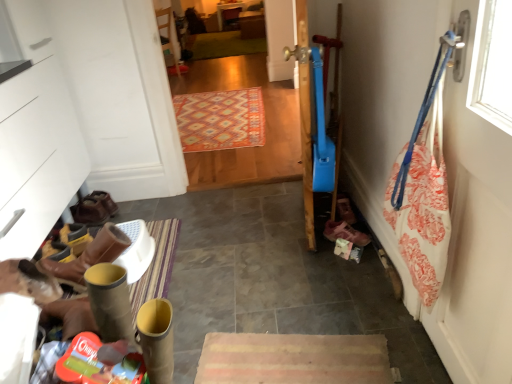
The image size is (512, 384). What do you see at coordinates (105, 201) in the screenshot? I see `brown leather boots at lower left, positioned as the second footwear in right-to-left order` at bounding box center [105, 201].

You are a GUI agent. You are given a task and a screenshot of the screen. Output one action in this format:
    pyautogui.click(x=<x>, y=<y>)
    Task: Click on the green carpet at center, the first mat from the back
    The height and width of the screenshot is (384, 512).
    Given the screenshot: What is the action you would take?
    pyautogui.click(x=225, y=45)

This screenshot has width=512, height=384. Describe the element at coordinates (345, 233) in the screenshot. I see `pink fabric shoe at lower right, the 3th footwear positioned from the back` at that location.

The height and width of the screenshot is (384, 512). What do you see at coordinates (265, 125) in the screenshot?
I see `carpeted wooden floor at center` at bounding box center [265, 125].

What is the approximate height of carpeted wooden floor at center?

The height of carpeted wooden floor at center is 3.68 feet.

What do you see at coordinates (475, 235) in the screenshot? I see `white fabric at right` at bounding box center [475, 235].

The height and width of the screenshot is (384, 512). Identify the location of multicolored woven rug at center, the 1th mat viewed from the front. (220, 120).

Can you tell me how much brown leather boots at lower left, marked as the first footwear in a back-to-front arrangement, and pink fabric shoe at lower right, placed as the first footwear when sorted from right to left, differ in facing direction?

The facing directions of brown leather boots at lower left, marked as the first footwear in a back-to-front arrangement, and pink fabric shoe at lower right, placed as the first footwear when sorted from right to left, are 156 degrees apart.

Locate an element on the screen. The width and height of the screenshot is (512, 384). footwear that is the 2nd object located above the pink fabric shoe at lower right, placed as the first footwear when sorted from right to left (from the image's perspective) is located at coordinates (105, 201).

Is pink fabric shoe at lower right, the third footwear in the left-to-right sequence, a part of brown leather boots at lower left, the 2th footwear positioned from the left?

No, brown leather boots at lower left, the 2th footwear positioned from the left, does not contain pink fabric shoe at lower right, the third footwear in the left-to-right sequence.

Between brown leather boots at lower left, marked as the 3th footwear in a front-to-back arrangement, and pink fabric shoe at lower right, the 3th footwear positioned from the back, which one is positioned behind?

Positioned behind is brown leather boots at lower left, marked as the 3th footwear in a front-to-back arrangement.

From the image's perspective, which object appears higher, white fabric at right or carpeted wooden floor at center?

carpeted wooden floor at center, from the image's perspective.

From a real-world perspective, which object rests below the other?

From a 3D spatial view, carpeted wooden floor at center is below.

Which of these two, white fabric at right or carpeted wooden floor at center, is smaller?

white fabric at right is smaller.

From the picture: Measure the distance between white fabric at right and carpeted wooden floor at center.

white fabric at right is 2.32 meters from carpeted wooden floor at center.

From a real-world perspective, which object rests below the other?

brown leather boots at lower left, positioned as the second footwear in back-to-front order, from a real-world perspective.

Measure the distance from carpeted wooden floor at center to brown leather boots at lower left, positioned as the second footwear in back-to-front order.

carpeted wooden floor at center and brown leather boots at lower left, positioned as the second footwear in back-to-front order, are 6.17 feet apart.

From the image's perspective, who appears lower, carpeted wooden floor at center or brown leather boots at lower left, which is counted as the second footwear, starting from the front?

brown leather boots at lower left, which is counted as the second footwear, starting from the front, appears lower in the image.

Which point is more distant from viewer, (227, 48) or (337, 230)?

The point (227, 48) is behind.

You are a GUI agent. You are given a task and a screenshot of the screen. Output one action in this format:
    pyautogui.click(x=<x>, y=<y>)
    Task: Click on the 1st footwear above the green carpet at center, placed as the 2th mat when sorted from front to back (from a real-world perspective)
    This screenshot has height=384, width=512.
    Given the screenshot: What is the action you would take?
    pyautogui.click(x=345, y=233)

Does green carpet at center, the first mat from the back, lie in front of pink fabric shoe at lower right, which is the 1th footwear in front-to-back order?

No, green carpet at center, the first mat from the back, is behind pink fabric shoe at lower right, which is the 1th footwear in front-to-back order.

From the image's perspective, is green carpet at center, the first mat positioned from the top, located above pink fabric shoe at lower right, which is the 1th footwear in front-to-back order?

Indeed, from the image's perspective, green carpet at center, the first mat positioned from the top, is shown above pink fabric shoe at lower right, which is the 1th footwear in front-to-back order.

Is pink fabric shoe at lower right, which is the 1th footwear in front-to-back order, directly adjacent to multicolored woven rug at center, which appears as the 1th mat when ordered from the bottom?

pink fabric shoe at lower right, which is the 1th footwear in front-to-back order, and multicolored woven rug at center, which appears as the 1th mat when ordered from the bottom, are not in contact.

In the image, is pink fabric shoe at lower right, placed as the first footwear when sorted from right to left, positioned in front of or behind multicolored woven rug at center, which appears as the 1th mat when ordered from the bottom?

Visually, pink fabric shoe at lower right, placed as the first footwear when sorted from right to left, is located in front of multicolored woven rug at center, which appears as the 1th mat when ordered from the bottom.

Looking at this image, from the image's perspective, is pink fabric shoe at lower right, which is the 1th footwear in front-to-back order, located beneath multicolored woven rug at center, the 2th mat when ordered from top to bottom?

Correct, pink fabric shoe at lower right, which is the 1th footwear in front-to-back order, appears lower than multicolored woven rug at center, the 2th mat when ordered from top to bottom, in the image.

Could multicolored woven rug at center, the 1th mat viewed from the front, be considered to be inside pink fabric shoe at lower right, placed as the first footwear when sorted from right to left?

No, multicolored woven rug at center, the 1th mat viewed from the front, is not a part of pink fabric shoe at lower right, placed as the first footwear when sorted from right to left.

Between carpeted wooden floor at center and brown leather boots at lower left, marked as the first footwear in a back-to-front arrangement, which one has larger width?

brown leather boots at lower left, marked as the first footwear in a back-to-front arrangement.

Can you tell me how much carpeted wooden floor at center and brown leather boots at lower left, marked as the first footwear in a back-to-front arrangement, differ in facing direction?

103 degrees.

Considering the positions of objects carpeted wooden floor at center and brown leather boots at lower left, marked as the 3th footwear in a front-to-back arrangement, in the image provided, who is more to the left, carpeted wooden floor at center or brown leather boots at lower left, marked as the 3th footwear in a front-to-back arrangement,?

Positioned to the left is brown leather boots at lower left, marked as the 3th footwear in a front-to-back arrangement.

Is carpeted wooden floor at center inside or outside of brown leather boots at lower left, the 2th footwear positioned from the left?

carpeted wooden floor at center is not enclosed by brown leather boots at lower left, the 2th footwear positioned from the left.

Between point (195, 94) and point (208, 62), which one is positioned in front?

The point (195, 94) is more forward.

Is multicolored woven rug at center, which ranks as the 2th mat in back-to-front order, bigger than carpeted wooden floor at center?

No, multicolored woven rug at center, which ranks as the 2th mat in back-to-front order, is not bigger than carpeted wooden floor at center.

From the image's perspective, count 2nd footwears downward from the brown leather boots at lower left, positioned as the second footwear in right-to-left order, and point to it. Please provide its 2D coordinates.

[(345, 233)]

This screenshot has width=512, height=384. In order to click on door above the carpeted wooden floor at center (from a real-world perspective) in this screenshot , I will do `click(475, 235)`.

When comparing their distances from green carpet at center, the first mat from the back, does pink fabric shoe at lower right, the 3th footwear positioned from the back, or brown leather boots at lower left, which is counted as the second footwear, starting from the front, seem closer?

The object closer to green carpet at center, the first mat from the back, is brown leather boots at lower left, which is counted as the second footwear, starting from the front.

Considering their positions, is green carpet at center, the first mat positioned from the top, positioned closer to brown leather boots at lower left, the 1th footwear from the left, than multicolored woven rug at center, which ranks as the 2th mat in back-to-front order?

multicolored woven rug at center, which ranks as the 2th mat in back-to-front order.

From the picture: Looking at the image, which one is located further to green carpet at center, which is the 2th mat from bottom to top, brown leather boots at lower left, positioned as the second footwear in back-to-front order, or pink fabric shoe at lower right, the 3th footwear positioned from the back?

Among the two, pink fabric shoe at lower right, the 3th footwear positioned from the back, is located further to green carpet at center, which is the 2th mat from bottom to top.

When comparing their distances from green carpet at center, the first mat positioned from the top, does multicolored woven rug at center, the 2th mat when ordered from top to bottom, or pink fabric shoe at lower right, the third footwear in the left-to-right sequence, seem closer?

multicolored woven rug at center, the 2th mat when ordered from top to bottom, is closer to green carpet at center, the first mat positioned from the top.

From the image, which object appears to be farther from green carpet at center, the first mat from the back, carpeted wooden floor at center or multicolored woven rug at center, which ranks as the 2th mat in back-to-front order?

multicolored woven rug at center, which ranks as the 2th mat in back-to-front order, lies further to green carpet at center, the first mat from the back, than the other object.

Estimate the real-world distances between objects in this image. Which object is closer to brown leather boots at lower left, which is counted as the second footwear, starting from the front, green carpet at center, the first mat from the back, or white fabric at right?

white fabric at right is closer to brown leather boots at lower left, which is counted as the second footwear, starting from the front.

Estimate the real-world distances between objects in this image. Which object is closer to green carpet at center, the first mat from the back, white fabric at right or brown leather boots at lower left, marked as the 3th footwear in a front-to-back arrangement?

Among the two, brown leather boots at lower left, marked as the 3th footwear in a front-to-back arrangement, is located nearer to green carpet at center, the first mat from the back.

Considering their positions, is multicolored woven rug at center, the 2th mat when ordered from top to bottom, positioned closer to green carpet at center, placed as the 2th mat when sorted from front to back, than white fabric at right?

Among the two, multicolored woven rug at center, the 2th mat when ordered from top to bottom, is located nearer to green carpet at center, placed as the 2th mat when sorted from front to back.

The height and width of the screenshot is (384, 512). Identify the location of corridor positioned between white fabric at right and multicolored woven rug at center, which appears as the 1th mat when ordered from the bottom, from near to far. (265, 125).

Where is `footwear between brown leather boots at lower left, the 3th footwear when ordered from right to left, and pink fabric shoe at lower right, which is the 1th footwear in front-to-back order, from left to right`? Image resolution: width=512 pixels, height=384 pixels. footwear between brown leather boots at lower left, the 3th footwear when ordered from right to left, and pink fabric shoe at lower right, which is the 1th footwear in front-to-back order, from left to right is located at coordinates (105, 201).

I want to click on corridor positioned between white fabric at right and green carpet at center, which is the 2th mat from bottom to top, from near to far, so click(x=265, y=125).

Find the location of a particular element. The width and height of the screenshot is (512, 384). mat between carpeted wooden floor at center and green carpet at center, the first mat from the back, in the front-back direction is located at coordinates (220, 120).